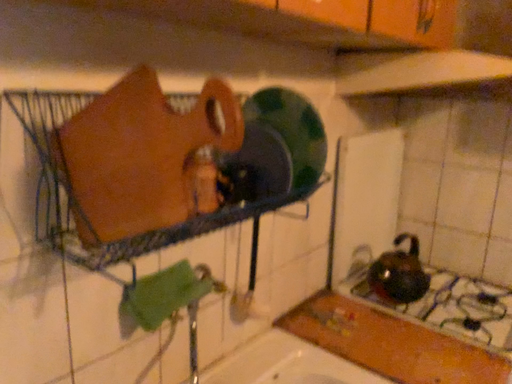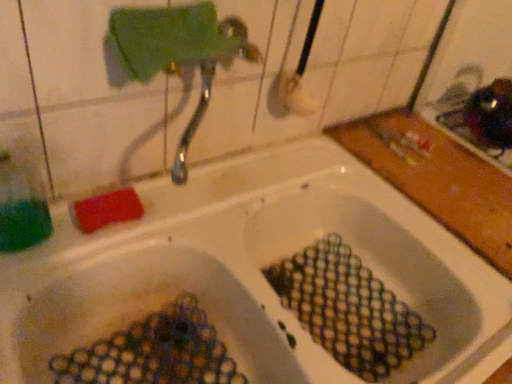
Question: Which way did the camera rotate in the video?

Choices:
 (A) rotated downward
 (B) rotated upward

Answer: (A)